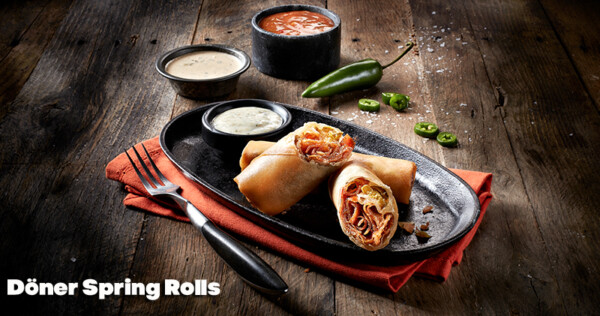
At what (x,y) coordinates should I click in order to perform the action: click on fork. Please return your answer as a coordinate pair (x, y). This screenshot has width=600, height=316. Looking at the image, I should click on (160, 189).